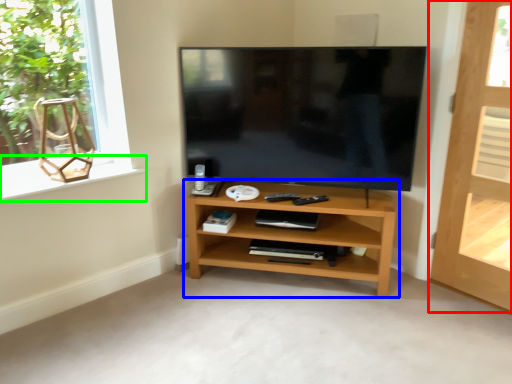
Question: Which object is positioned farthest from door (highlighted by a red box)? Select from shelf (highlighted by a blue box) and window sill (highlighted by a green box).

Choices:
 (A) shelf
 (B) window sill

Answer: (B)